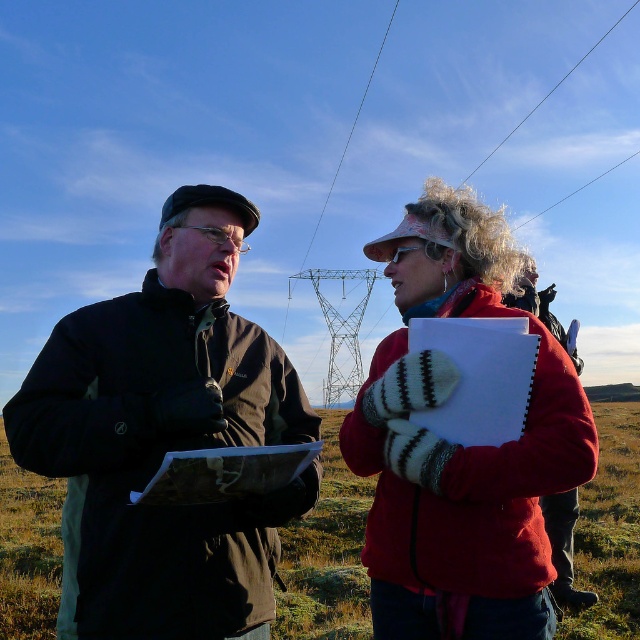
In the scene shown: You are standing at the origin point of the image. Which direction should you move to reach the dark brown jacket at center?

The dark brown jacket at center is located at point 0.678 on the x axis and 0.263 on the y axis. Since you are at the origin point, you should move to the right and slightly downward to reach it.

You are standing in a field and want to place a small flag at the point closer to you between point (134, 632) and point (371, 595). Which point should you choose?

You should choose point (134, 632) because it is closer to the viewer than point (371, 595).